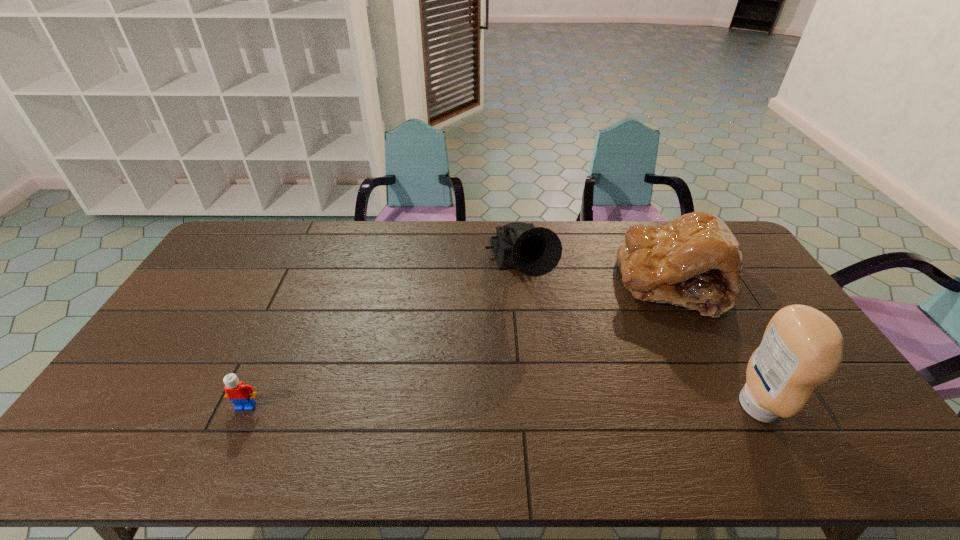
Identify the location of empty space between the third shortest object and the condiment. The image size is (960, 540). (638, 337).

Find the location of a particular element. Image resolution: width=960 pixels, height=540 pixels. vacant space in between the shortest object and the third object from right to left is located at coordinates (382, 338).

At what (x,y) coordinates should I click in order to perform the action: click on vacant area between the condiment and the third shortest object. Please return your answer as a coordinate pair (x, y). The image size is (960, 540). Looking at the image, I should click on (638, 337).

Choose which object is the nearest neighbor to the third tallest object. Please provide its 2D coordinates. Your answer should be formatted as a tuple, i.e. [(x, y)], where the tuple contains the x and y coordinates of a point satisfying the conditions above.

[(535, 251)]

Select which object is the third closest to the condiment. Please provide its 2D coordinates. Your answer should be formatted as a tuple, i.e. [(x, y)], where the tuple contains the x and y coordinates of a point satisfying the conditions above.

[(242, 395)]

I want to click on free location that satisfies the following two spatial constraints: 1. on the front side of the condiment; 2. on the label of the second shortest object, so click(x=732, y=406).